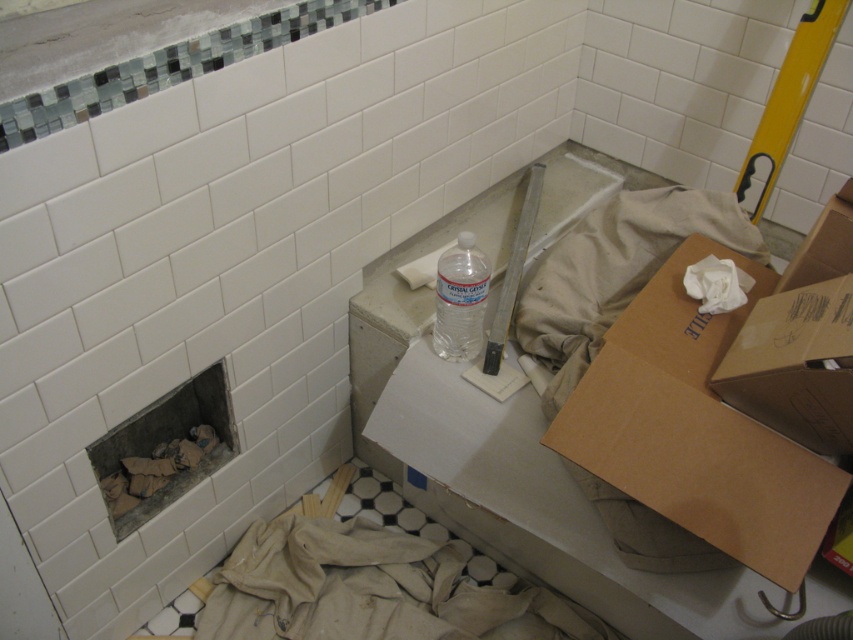
Who is taller, white crumpled toilet paper at center-right or white matte toilet paper at center?

Standing taller between the two is white matte toilet paper at center.

Between point (729, 276) and point (410, 272), which one is positioned in front?

Point (729, 276) is in front.

At what (x,y) coordinates should I click in order to perform the action: click on white crumpled toilet paper at center-right. Please return your answer as a coordinate pair (x, y). This screenshot has height=640, width=853. Looking at the image, I should click on (717, 284).

Which of these two, clear plastic bottle at center or white crumpled toilet paper at center-right, stands shorter?

white crumpled toilet paper at center-right is shorter.

Is clear plastic bottle at center above white crumpled toilet paper at center-right?

No.

The width and height of the screenshot is (853, 640). Describe the element at coordinates (460, 300) in the screenshot. I see `clear plastic bottle at center` at that location.

At what (x,y) coordinates should I click in order to perform the action: click on clear plastic bottle at center. Please return your answer as a coordinate pair (x, y). This screenshot has width=853, height=640. Looking at the image, I should click on (460, 300).

From the picture: Which of these two, brown cardboard box at lower right or white crumpled toilet paper at center-right, stands shorter?

With less height is white crumpled toilet paper at center-right.

Which of these two, brown cardboard box at lower right or white crumpled toilet paper at center-right, stands taller?

brown cardboard box at lower right

What do you see at coordinates (695, 428) in the screenshot?
I see `brown cardboard box at lower right` at bounding box center [695, 428].

Locate an element on the screen. This screenshot has width=853, height=640. brown cardboard box at lower right is located at coordinates (695, 428).